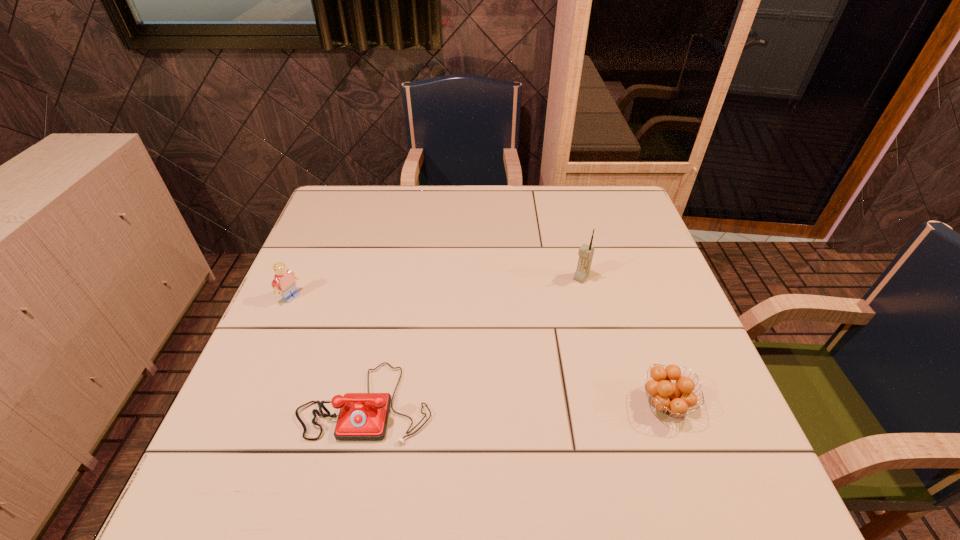
The width and height of the screenshot is (960, 540). I want to click on free space on the desktop that is between the telephone and the rightmost object and is positioned on the front of the tallest object, where the keypad is located, so click(x=481, y=403).

Where is `vacant space on the desktop that is between the second object from left to right and the rightmost object and is positioned on the front-facing side of the third shortest object`? This screenshot has width=960, height=540. vacant space on the desktop that is between the second object from left to right and the rightmost object and is positioned on the front-facing side of the third shortest object is located at coordinates (489, 403).